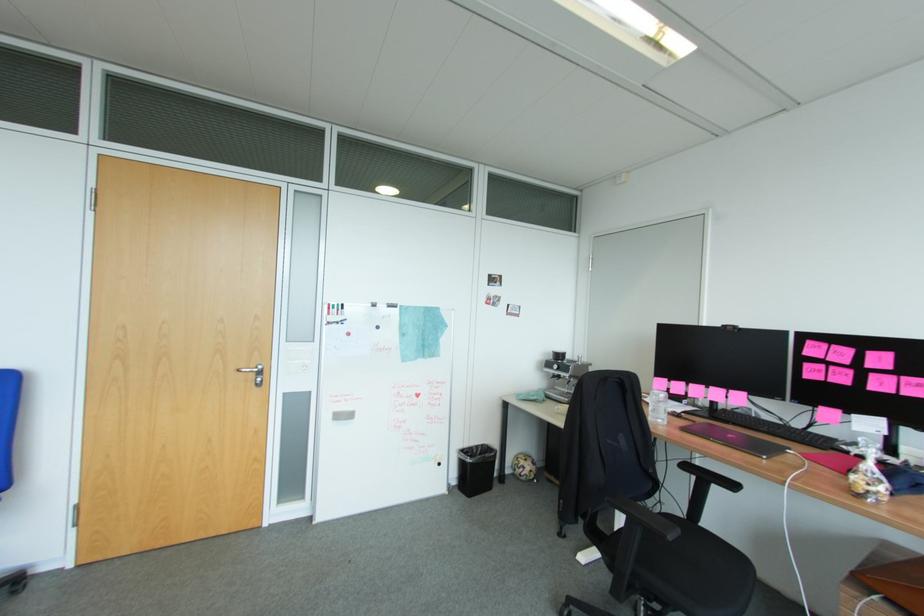
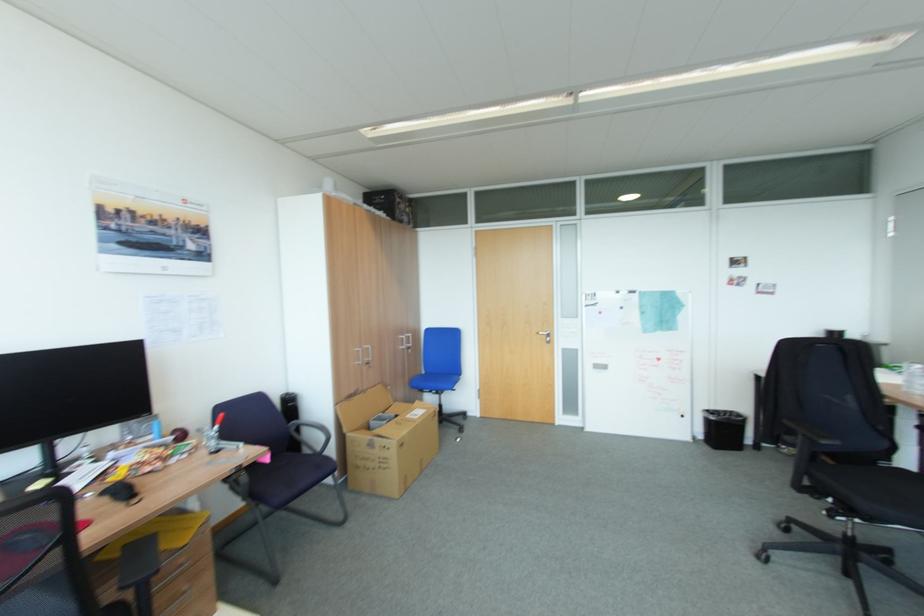
Locate, in the second image, the point that corresponds to the point at 258,374 in the first image.

(551, 336)